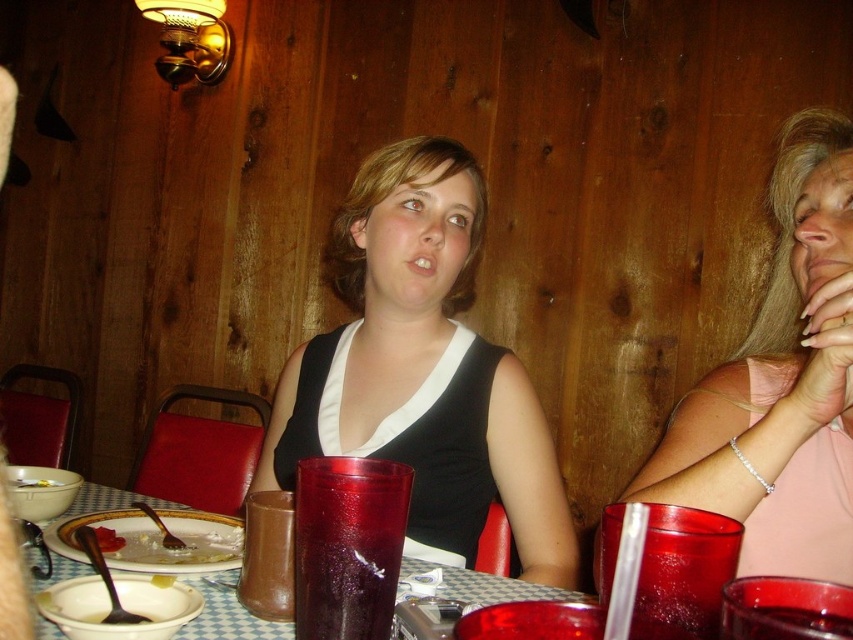
You are a server in the cabin and need to deliver a drink to the customer. The customer is sitting at the table with the matte black tank top at center and the translucent plastic cup at center. Which object should you avoid placing the drink on to ensure it stays visible to the customer?

You should avoid placing the drink on the matte black tank top at center because it is closer to the customer and might obstruct their view, while the translucent plastic cup at center is farther away and more suitable for placing the drink.

You are sitting at the table in the cabin and want to reach both the point at coordinates point (718, 554) and point (292, 497). Which point is closer to you?

Point (718, 554) is closer to the viewer than point (292, 497), so you can reach it first.